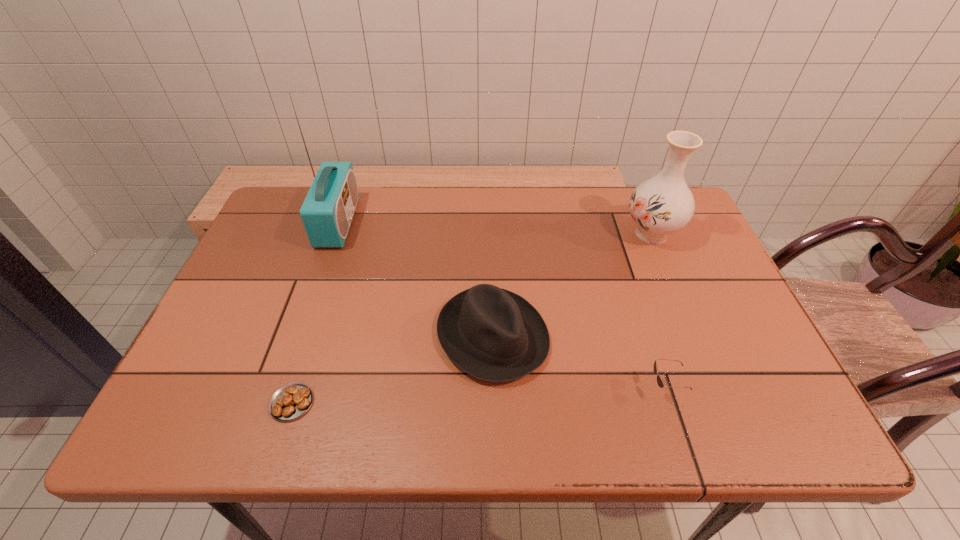
Where is `vacant area in the image that satisfies the following two spatial constraints: 1. on the front panel of the radio receiver; 2. on the back side of the third object from right to left`? The image size is (960, 540). vacant area in the image that satisfies the following two spatial constraints: 1. on the front panel of the radio receiver; 2. on the back side of the third object from right to left is located at coordinates (299, 335).